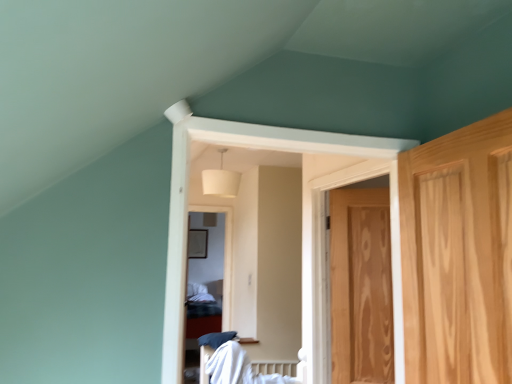
This screenshot has width=512, height=384. What do you see at coordinates (242, 367) in the screenshot?
I see `white cotton bed at center` at bounding box center [242, 367].

Measure the distance between point (x=228, y=183) and camera.

Point (x=228, y=183) and camera are 3.04 meters apart from each other.

The image size is (512, 384). I want to click on wooden door at right, so click(x=361, y=286).

Locate an element on the screen. The image size is (512, 384). white cotton bed at center is located at coordinates (242, 367).

From the image's perspective, which is below, white fabric lampshade at upper center or wooden door at right?

wooden door at right appears lower in the image.

Could you tell me if white fabric lampshade at upper center is turned towards wooden door at right?

No, white fabric lampshade at upper center is not facing towards wooden door at right.

Considering the sizes of white fabric lampshade at upper center and wooden door at right in the image, is white fabric lampshade at upper center wider or thinner than wooden door at right?

white fabric lampshade at upper center is wider than wooden door at right.

Is point (221, 162) closer or farther from the camera than point (218, 368)?

Point (221, 162) is positioned farther from the camera compared to point (218, 368).

Looking at this image, what's the angular difference between white fabric lampshade at upper center and white cotton bed at center's facing directions?

There is a 8.58-degree angle between the facing directions of white fabric lampshade at upper center and white cotton bed at center.

Which of these two, white fabric lampshade at upper center or white cotton bed at center, stands taller?

Standing taller between the two is white fabric lampshade at upper center.

Is white fabric lampshade at upper center wider or thinner than white cotton bed at center?

Clearly, white fabric lampshade at upper center has less width compared to white cotton bed at center.

Based on the photo, from a real-world perspective, which is physically below, wooden door at right or white fabric lampshade at upper center?

In real-world perspective, wooden door at right is lower.

Does wooden door at right have a greater height compared to white fabric lampshade at upper center?

A: Indeed, wooden door at right has a greater height compared to white fabric lampshade at upper center.

From the picture: Is wooden door at right in front of or behind white fabric lampshade at upper center in the image?

wooden door at right is in front of white fabric lampshade at upper center.

Between wooden door at right and white fabric lampshade at upper center, which one appears on the left side from the viewer's perspective?

white fabric lampshade at upper center is more to the left.

Is wooden door at right completely or partially inside white cotton bed at center?

No, white cotton bed at center does not contain wooden door at right.

Is white cotton bed at center facing towards wooden door at right?

No, white cotton bed at center is not oriented towards wooden door at right.

Between white cotton bed at center and wooden door at right, which one has smaller width?

Thinner between the two is wooden door at right.

From a real-world perspective, which object rests below the other?

In real-world perspective, white cotton bed at center is lower.

Looking at this image, is white cotton bed at center taller than white fabric lampshade at upper center?

No, white cotton bed at center is not taller than white fabric lampshade at upper center.

How many degrees apart are the facing directions of white cotton bed at center and white fabric lampshade at upper center?

The facing directions of white cotton bed at center and white fabric lampshade at upper center are 8.58 degrees apart.

Does white cotton bed at center appear on the right side of white fabric lampshade at upper center?

Yes.

Which point is more forward, (245, 351) or (232, 179)?

The point (245, 351) is more forward.

From a real-world perspective, does wooden door at right stand above white cotton bed at center?

Yes.

Is wooden door at right smaller than white cotton bed at center?

Indeed, wooden door at right has a smaller size compared to white cotton bed at center.

Does wooden door at right come in front of white cotton bed at center?

No.

Locate an element on the screen. lamp that is above the wooden door at right (from a real-world perspective) is located at coordinates (221, 180).

This screenshot has width=512, height=384. I want to click on bed below the white fabric lampshade at upper center (from a real-world perspective), so click(242, 367).

Estimate the real-world distances between objects in this image. Which object is further from wooden door at right, white cotton bed at center or white fabric lampshade at upper center?

The object further to wooden door at right is white fabric lampshade at upper center.

Based on their spatial positions, is wooden door at right or white cotton bed at center closer to white fabric lampshade at upper center?

white cotton bed at center is positioned closer to the anchor white fabric lampshade at upper center.

From the image, which object appears to be farther from white cotton bed at center, wooden door at right or white fabric lampshade at upper center?

white fabric lampshade at upper center.

Based on their spatial positions, is white fabric lampshade at upper center or wooden door at right closer to white cotton bed at center?

Based on the image, wooden door at right appears to be nearer to white cotton bed at center.

Considering their positions, is white fabric lampshade at upper center positioned further to wooden door at right than white cotton bed at center?

white fabric lampshade at upper center.

Estimate the real-world distances between objects in this image. Which object is further from white fabric lampshade at upper center, white cotton bed at center or wooden door at right?

wooden door at right.

Find the location of `door between white fabric lampshade at upper center and white cotton bed at center in the up-down direction`. door between white fabric lampshade at upper center and white cotton bed at center in the up-down direction is located at coordinates (361, 286).